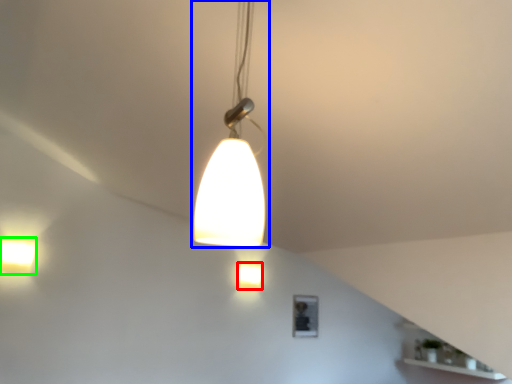
Question: Estimate the real-world distances between objects in this image. Which object is closer to lamp (highlighted by a red box), lamp (highlighted by a blue box) or lamp (highlighted by a green box)?

Choices:
 (A) lamp
 (B) lamp

Answer: (B)